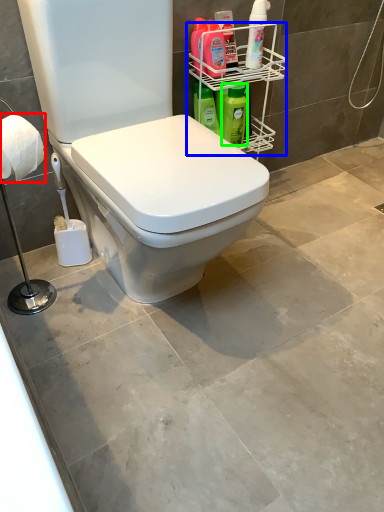
Question: Which is nearer to the toilet paper (highlighted by a red box)? shelf (highlighted by a blue box) or cleaning product (highlighted by a green box).

Choices:
 (A) shelf
 (B) cleaning product

Answer: (B)